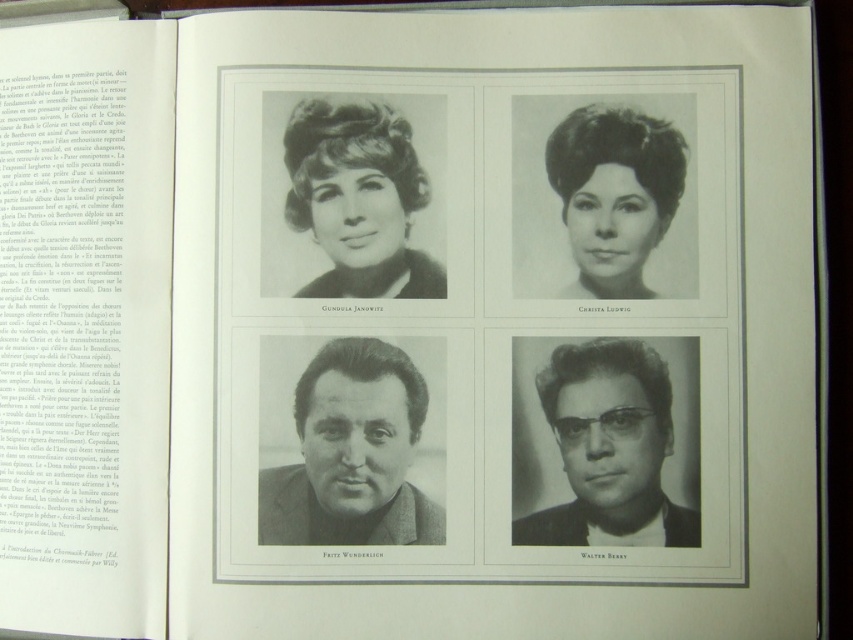
Question: Which is farther from the smooth black hair at upper right?

Choices:
 (A) matte black glasses at bottom right
 (B) matte black jacket at center
 (C) matte black hair at upper left

Answer: (B)

Question: Is matte black glasses at bottom right above matte black hair at upper left?

Choices:
 (A) yes
 (B) no

Answer: (B)

Question: Is matte black glasses at bottom right positioned in front of matte black hair at upper left?

Choices:
 (A) yes
 (B) no

Answer: (A)

Question: Among these points, which one is farthest from the camera?

Choices:
 (A) (408, 408)
 (B) (654, 467)
 (C) (392, 250)
 (D) (572, 195)

Answer: (C)

Question: Can you confirm if matte black glasses at bottom right is positioned above matte black hair at upper left?

Choices:
 (A) no
 (B) yes

Answer: (A)

Question: Which point is farther from the camera taking this photo?

Choices:
 (A) tap(346, 154)
 (B) tap(599, 496)
 (C) tap(326, 492)

Answer: (A)